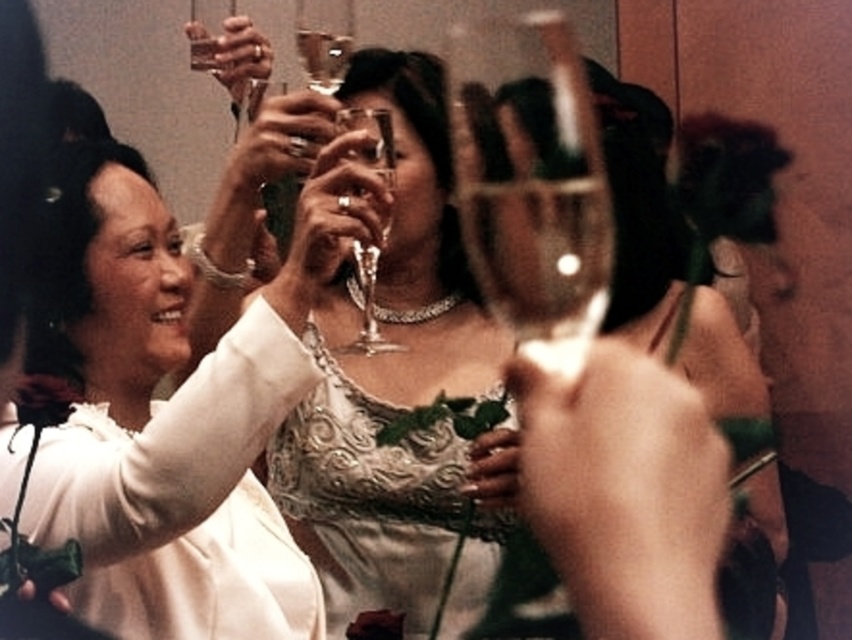
You are a photographer trying to capture a closeup of the champagne glass at point (x=61, y=468). The camera you are using has a focal length of 50mm and a sensor size of 24mm. What is the minimum distance you need to be from the glass to get a clear shot?

To determine the minimum distance required, we can use the formula for the minimum focus distance of a camera lens, which is given by the focal length divided by the sensor size. In this case, the focal length is 50mm and the sensor size is 24mm. Plugging these values into the formula gives 50mm divided by 24mm, resulting in approximately 2.08 meters. However, the point (x=61, y=468) is only 1.21 meters away from the camera. This means the camera cannot focus on the glass at that distance because it is too

You are a photographer standing at the camera position. You want to adjust your lens to focus on the satin lace dress at center. What is the minimum distance you need to set your lens focus to ensure the dress is in sharp focus?

The minimum distance you need to set your lens focus is 1.49 meters, as the satin lace dress at center is exactly 1.49 meters away from the camera.

You are a photographer at a social event and want to ensure that both the white satin dress at left and the transparent glass wine glass at center are clearly visible in your photo. Which object should you focus on to ensure it takes up more space in the frame?

The transparent glass wine glass at center occupies more space in the frame than the white satin dress at left, so focusing on it would ensure it takes up more space in the photo.